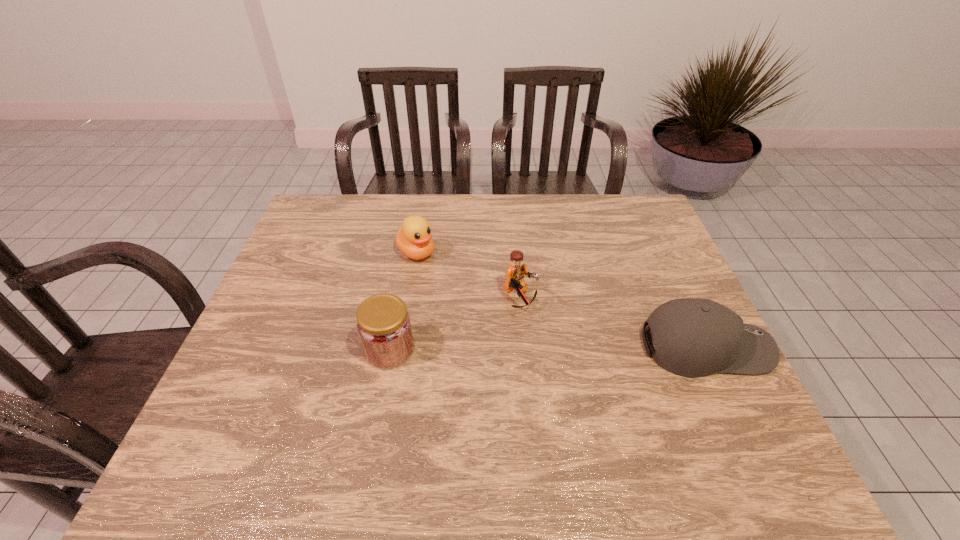
The height and width of the screenshot is (540, 960). Find the location of `jam`. jam is located at coordinates (384, 326).

The height and width of the screenshot is (540, 960). What are the coordinates of `baseball cap` in the screenshot? It's located at click(693, 337).

I want to click on duckling, so click(413, 239).

Find the location of a particular element. The width and height of the screenshot is (960, 540). the third nearest object is located at coordinates (516, 271).

This screenshot has width=960, height=540. In order to click on the third object from left to right in this screenshot , I will do `click(516, 271)`.

Locate an element on the screen. Image resolution: width=960 pixels, height=540 pixels. free spot located 0.110m on the right of the jam is located at coordinates (461, 349).

Where is `vacant area situated 0.170m on the face of the farthest object`? The image size is (960, 540). vacant area situated 0.170m on the face of the farthest object is located at coordinates (463, 293).

This screenshot has width=960, height=540. Identify the location of vacant space located on the face of the farthest object. click(x=466, y=295).

The height and width of the screenshot is (540, 960). In order to click on free point located 0.110m on the face of the farthest object in this screenshot , I will do `click(450, 282)`.

The width and height of the screenshot is (960, 540). What are the coordinates of `free space located 0.370m holding a crossbow in the hands of the Lego` in the screenshot? It's located at (650, 412).